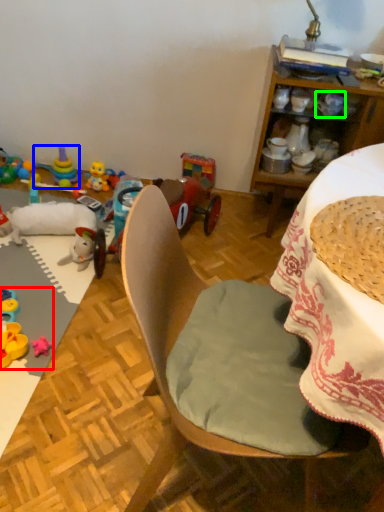
Question: Which object is the farthest from toy (highlighted by a red box)? Choose among these: toy (highlighted by a blue box) or coffee cup (highlighted by a green box).

Choices:
 (A) toy
 (B) coffee cup

Answer: (B)